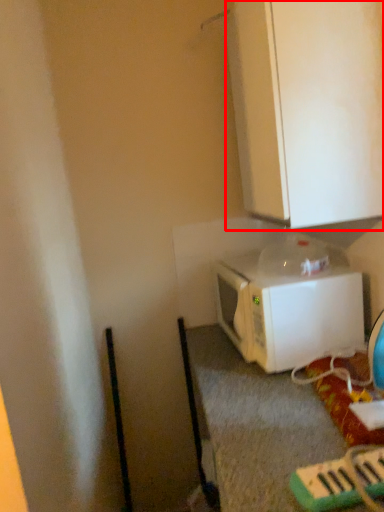
Question: From the image's perspective, where is cabinetry (annotated by the red box) located relative to microwave oven?

Choices:
 (A) below
 (B) above

Answer: (B)